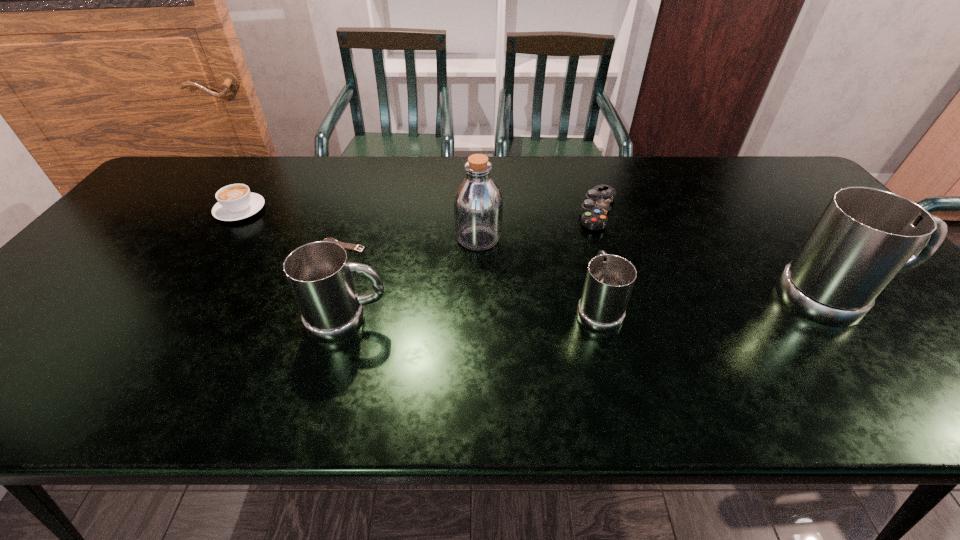
Find the location of `bottle`. bottle is located at coordinates (478, 203).

Where is `vacant space located 0.050m on the side of the fifth shortest object with the handle`? vacant space located 0.050m on the side of the fifth shortest object with the handle is located at coordinates (412, 320).

Locate an element on the screen. Image resolution: width=960 pixels, height=540 pixels. vacant area situated 0.370m on the side of the fourth tallest object with the handle is located at coordinates (569, 200).

Find the location of a particular element. The height and width of the screenshot is (540, 960). free region located 0.370m on the side of the fourth tallest object with the handle is located at coordinates (569, 200).

The height and width of the screenshot is (540, 960). I want to click on free point located 0.150m on the side of the fourth tallest object with the handle, so click(x=582, y=246).

You are a GUI agent. You are given a task and a screenshot of the screen. Output one action in this format:
    pyautogui.click(x=<x>, y=<y>)
    Task: Click on the vacant position located on the front of the shortest object
    Image resolution: width=960 pixels, height=540 pixels.
    Given the screenshot: What is the action you would take?
    pyautogui.click(x=324, y=299)

Find the location of a particular element. free space located on the back of the control is located at coordinates (581, 159).

Locate an element on the screen. free location located on the side of the third shortest object with the handle is located at coordinates (262, 177).

You are a GUI agent. You are given a task and a screenshot of the screen. Output one action in this format:
    pyautogui.click(x=<x>, y=<y>)
    Task: Click on the vacant space located 0.170m on the side of the third shortest object with the handle
    This screenshot has height=540, width=960.
    Given the screenshot: What is the action you would take?
    pyautogui.click(x=268, y=167)

Find the location of a particular element. Image resolution: width=960 pixels, height=540 pixels. vacant space located on the side of the third shortest object with the handle is located at coordinates (256, 186).